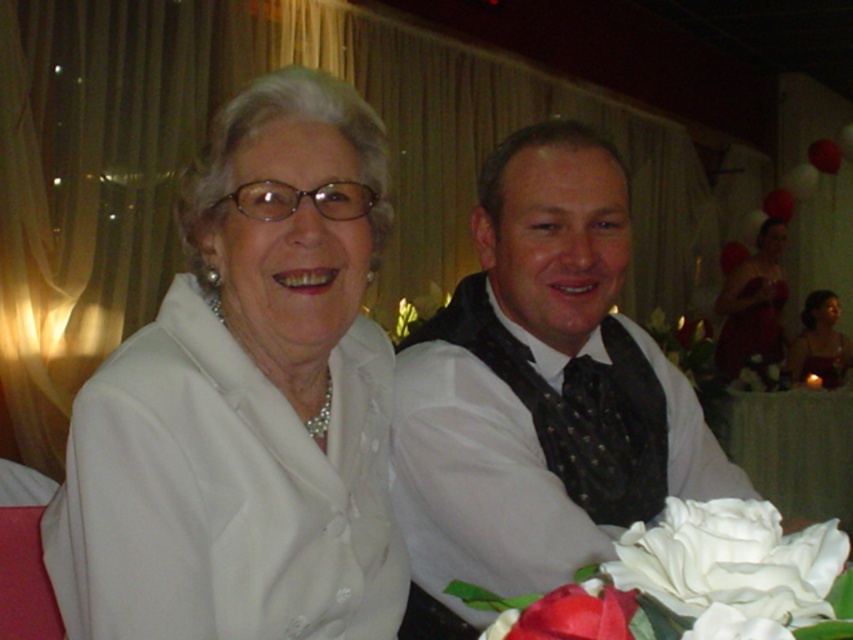
Question: Can you confirm if white satin jacket at upper left is bigger than matte red dress at right?

Choices:
 (A) yes
 (B) no

Answer: (B)

Question: Which point is closer to the camera taking this photo?

Choices:
 (A) (395, 464)
 (B) (801, 349)
 (C) (633, 608)

Answer: (C)

Question: Is velvet red dress at right smaller than matte red rose at lower center?

Choices:
 (A) yes
 (B) no

Answer: (B)

Question: Which point is closer to the camera?

Choices:
 (A) matte red dress at right
 (B) matte red rose at lower center

Answer: (B)

Question: Which point appears farthest from the camera in this image?

Choices:
 (A) (772, 316)
 (B) (773, 426)

Answer: (A)

Question: Is white satin jacket at upper left wider than white textured vest at center?

Choices:
 (A) no
 (B) yes

Answer: (A)